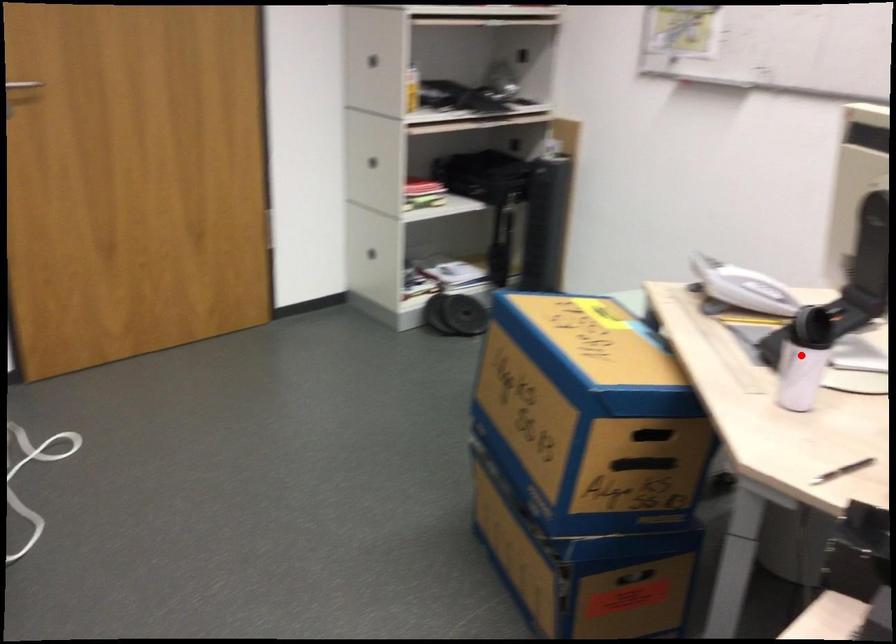
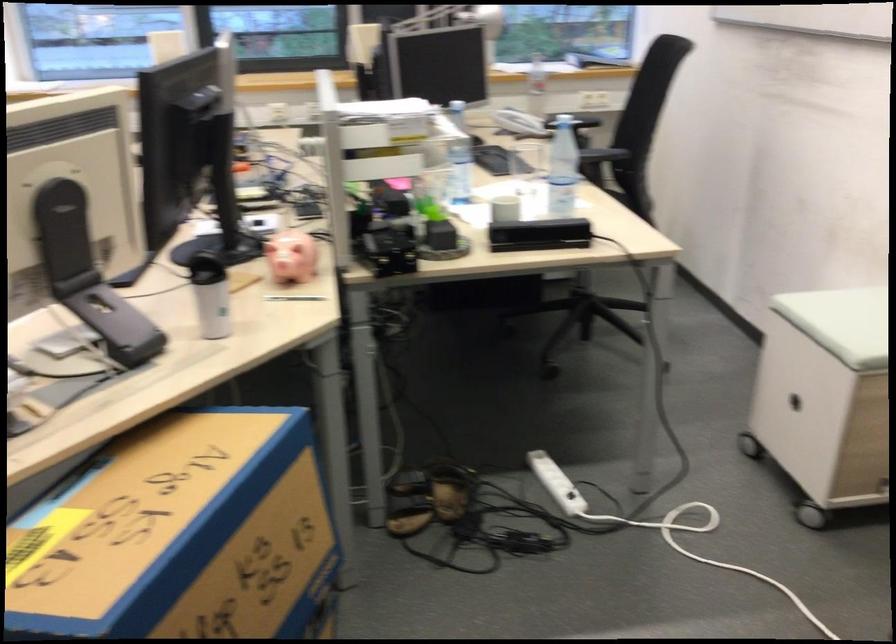
Find the pixel in the second image that matches the highlighted location in the first image.

(211, 295)